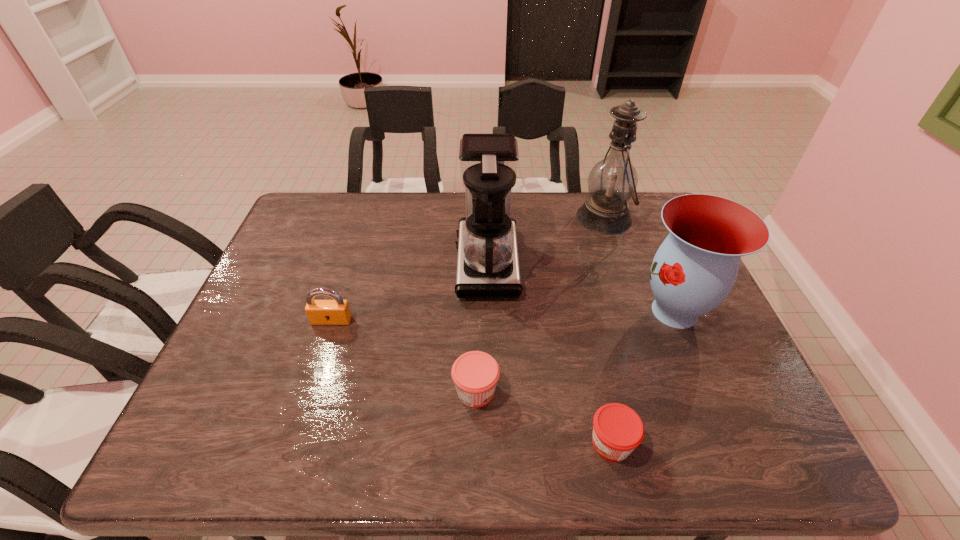
Locate an element on the screen. This screenshot has width=960, height=540. coffee maker that is at the far edge is located at coordinates (488, 264).

The width and height of the screenshot is (960, 540). What are the coordinates of `object that is at the near edge` in the screenshot? It's located at (617, 429).

I want to click on oil lamp that is at the right edge, so click(611, 183).

Where is `vase at the right edge`? This screenshot has height=540, width=960. vase at the right edge is located at coordinates (695, 268).

Identify the location of object positioned at the far right corner. Image resolution: width=960 pixels, height=540 pixels. (611, 183).

I want to click on vacant area at the far edge of the desktop, so click(x=367, y=202).

At what (x,y) coordinates should I click in order to perform the action: click on free region at the left edge. Please return your answer as a coordinate pair (x, y). Looking at the image, I should click on (222, 373).

Find the location of a particular element. This screenshot has width=960, height=540. free space at the right edge is located at coordinates (696, 390).

The image size is (960, 540). In the image, there is a desktop. What are the coordinates of `free space at the far left corner` in the screenshot? It's located at (343, 194).

Locate an element on the screen. vacant space in between the leftmost object and the coffee maker is located at coordinates (409, 292).